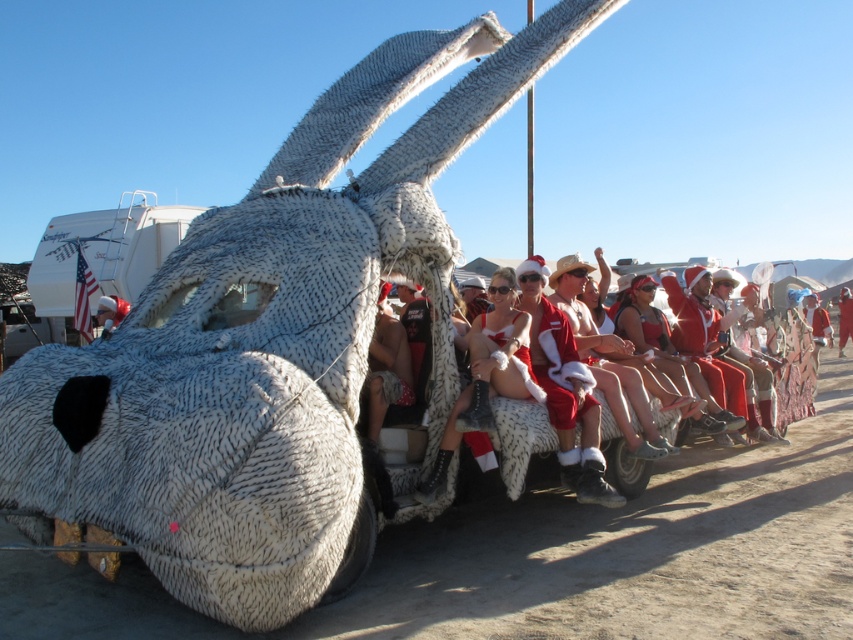
Can you confirm if white fur coat at center is shorter than red santa suit at center?

Correct, white fur coat at center is not as tall as red santa suit at center.

Who is taller, white fur coat at center or red santa suit at center?

red santa suit at center is taller.

The width and height of the screenshot is (853, 640). Describe the element at coordinates (520, 440) in the screenshot. I see `white fur coat at center` at that location.

Find the location of a particular element. The image size is (853, 640). white fur coat at center is located at coordinates (520, 440).

Locate an element on the screen. Image resolution: width=853 pixels, height=640 pixels. matte white helmet at center is located at coordinates (109, 312).

Is point (119, 298) less distant than point (840, 289)?

Yes.

Does point (120, 307) come behind point (843, 330)?

No, (120, 307) is in front of (843, 330).

At what (x,y) coordinates should I click in order to perform the action: click on matte white helmet at center. Please return your answer as a coordinate pair (x, y). The width and height of the screenshot is (853, 640). Looking at the image, I should click on (109, 312).

Is white fur coat at center taller than matte white helmet at center?

Correct, white fur coat at center is much taller as matte white helmet at center.

Based on the photo, how much distance is there between white fur coat at center and matte white helmet at center?

The distance of white fur coat at center from matte white helmet at center is 15.30 feet.

The image size is (853, 640). What do you see at coordinates (520, 440) in the screenshot?
I see `white fur coat at center` at bounding box center [520, 440].

You are a GUI agent. You are given a task and a screenshot of the screen. Output one action in this format:
    pyautogui.click(x=<x>, y=<y>)
    Task: Click on the white fur coat at center
    This screenshot has height=640, width=853.
    Given the screenshot: What is the action you would take?
    pyautogui.click(x=520, y=440)